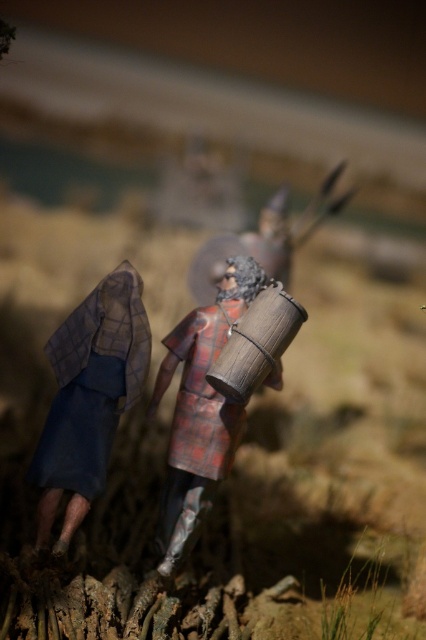
Is blue fabric cloak at left smaller than wooden barrel at center?

Yes, blue fabric cloak at left is smaller than wooden barrel at center.

Can you confirm if blue fabric cloak at left is positioned to the right of wooden barrel at center?

Incorrect, blue fabric cloak at left is not on the right side of wooden barrel at center.

Identify the location of blue fabric cloak at left. The width and height of the screenshot is (426, 640). (89, 396).